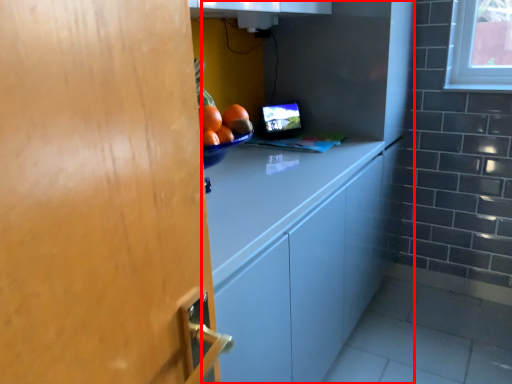
Question: From the image's perspective, what is the correct spatial relationship of cabinetry (annotated by the red box) in relation to computer monitor?

Choices:
 (A) below
 (B) above

Answer: (A)